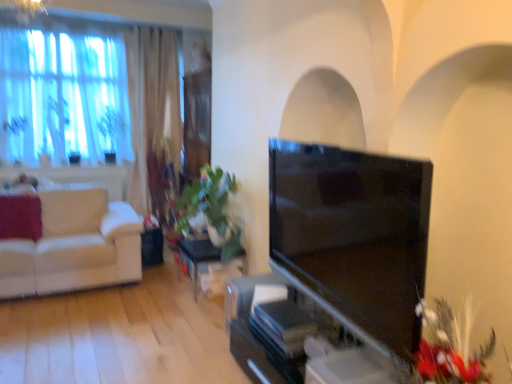
Locate an element on the screen. The image size is (512, 384). green leafy plant at center is located at coordinates (x=212, y=209).

You are a GUI agent. You are given a task and a screenshot of the screen. Output one action in this format:
    pyautogui.click(x=<x>, y=<y>)
    Task: Click on the green leafy plant at upper left
    The height and width of the screenshot is (384, 512).
    Given the screenshot: What is the action you would take?
    pyautogui.click(x=111, y=131)

You are a GUI agent. You are given a task and a screenshot of the screen. Output one action in this format:
    pyautogui.click(x=<x>, y=<y>)
    Task: Click on the green leafy plant at center
    
    Given the screenshot: What is the action you would take?
    pyautogui.click(x=212, y=209)

From the image's perspective, is fluffy red flowers at lower right under green leafy plant at upper left?

Yes, from the image's perspective, fluffy red flowers at lower right is beneath green leafy plant at upper left.

Does fluffy red flowers at lower right turn towards green leafy plant at upper left?

No, fluffy red flowers at lower right is not aimed at green leafy plant at upper left.

Is green leafy plant at upper left a part of fluffy red flowers at lower right?

No, green leafy plant at upper left is not a part of fluffy red flowers at lower right.

You are a GUI agent. You are given a task and a screenshot of the screen. Output one action in this format:
    pyautogui.click(x=<x>, y=<y>)
    Task: Click on the plant behind the fluffy red flowers at lower right
    The height and width of the screenshot is (384, 512).
    Given the screenshot: What is the action you would take?
    pyautogui.click(x=111, y=131)

From a real-world perspective, is fluffy red flowers at lower right located beneath green glossy table at center?

Incorrect, from a real-world perspective, fluffy red flowers at lower right is higher than green glossy table at center.

From the image's perspective, is fluffy red flowers at lower right positioned above or below green glossy table at center?

fluffy red flowers at lower right is situated higher than green glossy table at center in the image.

The image size is (512, 384). What are the coordinates of `floral arrangement located above the green glossy table at center (from the image's perspective)` in the screenshot? It's located at [x=449, y=348].

Between fluffy red flowers at lower right and green glossy table at center, which one appears on the left side from the viewer's perspective?

green glossy table at center is more to the left.

Considering the sizes of objects matte black tv at center and green leafy plant at upper left in the image provided, who is thinner, matte black tv at center or green leafy plant at upper left?

matte black tv at center.

Does matte black tv at center turn towards green leafy plant at upper left?

No.

Considering the points (361, 172) and (114, 117), which point is behind, point (361, 172) or point (114, 117)?

The point (114, 117) is farther.

From a real-world perspective, who is located higher, matte black tv at center or green leafy plant at upper left?

green leafy plant at upper left is physically above.

Between point (48, 236) and point (287, 171), which one is positioned in front?

The point (287, 171) is in front.

Is white fabric couch at left facing away from matte black tv at center?

white fabric couch at left is not turned away from matte black tv at center.

From a real-world perspective, relative to matte black tv at center, is white fabric couch at left vertically above or below?

white fabric couch at left is below matte black tv at center.

Considering the positions of objects green leafy plant at upper left and matte black tv at center in the image provided, who is in front, green leafy plant at upper left or matte black tv at center?

Positioned in front is matte black tv at center.

Can you tell me how much green leafy plant at upper left and matte black tv at center differ in facing direction?

They differ by 91 degrees in their facing directions.

From the image's perspective, which object appears higher, green leafy plant at upper left or matte black tv at center?

green leafy plant at upper left is shown above in the image.

Identify the location of plant lying behind the matte black tv at center. The width and height of the screenshot is (512, 384). (111, 131).

Considering the sizes of objects green glossy table at center and matte black tv at center in the image provided, who is thinner, green glossy table at center or matte black tv at center?

matte black tv at center is thinner.

Can you confirm if green glossy table at center is smaller than matte black tv at center?

Correct, green glossy table at center occupies less space than matte black tv at center.

Considering the relative sizes of green glossy table at center and matte black tv at center in the image provided, is green glossy table at center shorter than matte black tv at center?

Yes, green glossy table at center is shorter than matte black tv at center.

From a real-world perspective, is green glossy table at center on top of matte black tv at center?

No, from a real-world perspective, green glossy table at center is not above matte black tv at center.

Looking at this image, considering the relative sizes of green leafy plant at upper left and fluffy red flowers at lower right in the image provided, is green leafy plant at upper left wider than fluffy red flowers at lower right?

In fact, green leafy plant at upper left might be narrower than fluffy red flowers at lower right.

In the image, is green leafy plant at upper left on the left side or the right side of fluffy red flowers at lower right?

Clearly, green leafy plant at upper left is on the left of fluffy red flowers at lower right in the image.

Is point (112, 160) farther from viewer compared to point (440, 301)?

Yes, point (112, 160) is behind point (440, 301).

Is green leafy plant at upper left in front of fluffy red flowers at lower right?

No, green leafy plant at upper left is further to the viewer.

Where is `plant on the left of fluffy red flowers at lower right`? Image resolution: width=512 pixels, height=384 pixels. plant on the left of fluffy red flowers at lower right is located at coordinates (111, 131).

Where is `floral arrangement above the green glossy table at center (from the image's perspective)`? The height and width of the screenshot is (384, 512). floral arrangement above the green glossy table at center (from the image's perspective) is located at coordinates (449, 348).

Looking at the image, which one is located closer to matte black tv at center, green glossy table at center or green leafy plant at center?

green glossy table at center is positioned closer to the anchor matte black tv at center.

Estimate the real-world distances between objects in this image. Which object is further from green leafy plant at center, fluffy red flowers at lower right or white fabric couch at left?

Among the two, fluffy red flowers at lower right is located further to green leafy plant at center.

Looking at the image, which one is located further to matte black tv at center, green leafy plant at center or fluffy red flowers at lower right?

green leafy plant at center is positioned further to the anchor matte black tv at center.

Considering their positions, is fluffy red flowers at lower right positioned closer to green leafy plant at upper left than matte black tv at center?

Based on the image, matte black tv at center appears to be nearer to green leafy plant at upper left.

Which object lies further to the anchor point white fabric couch at left, green leafy plant at upper left or fluffy red flowers at lower right?

fluffy red flowers at lower right is positioned further to the anchor white fabric couch at left.

Based on their spatial positions, is white fabric couch at left or green glossy table at center closer to green leafy plant at upper left?

The object closer to green leafy plant at upper left is white fabric couch at left.

Which object lies nearer to the anchor point white fabric couch at left, green glossy table at center or green leafy plant at upper left?

green glossy table at center is positioned closer to the anchor white fabric couch at left.

Looking at the image, which one is located further to white fabric couch at left, fluffy red flowers at lower right or green leafy plant at center?

fluffy red flowers at lower right is further to white fabric couch at left.

Image resolution: width=512 pixels, height=384 pixels. Identify the location of table located between white fabric couch at left and matte black tv at center in the left-right direction. (208, 266).

This screenshot has height=384, width=512. In order to click on houseplant positioned between fluffy red flowers at lower right and green leafy plant at upper left from near to far in this screenshot , I will do `click(212, 209)`.

Locate an element on the screen. The height and width of the screenshot is (384, 512). table between green leafy plant at center and green leafy plant at upper left along the z-axis is located at coordinates (208, 266).

This screenshot has height=384, width=512. What are the coordinates of `studio couch between matte black tv at center and green leafy plant at upper left from front to back` in the screenshot? It's located at (74, 246).